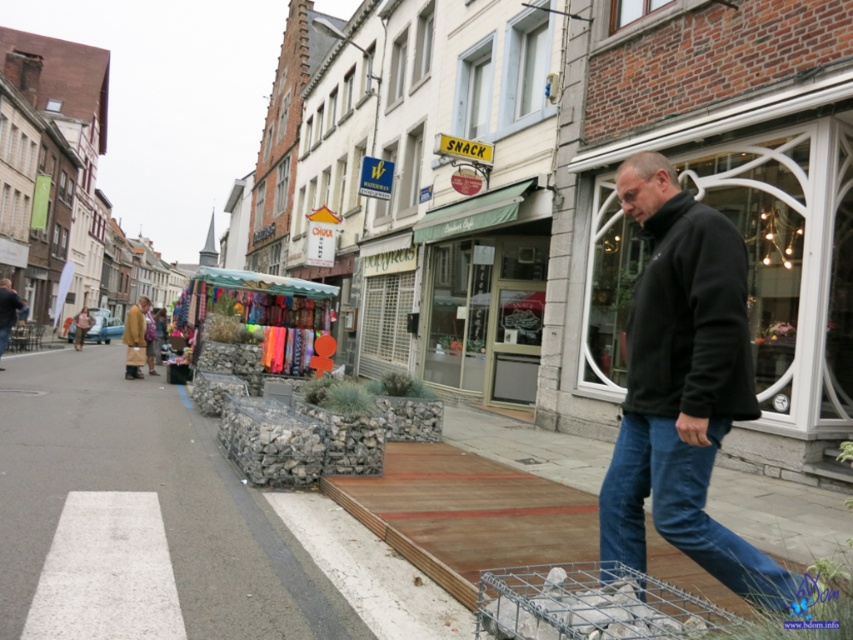
Question: Can you confirm if dark brown leather jacket at lower left is positioned to the right of light brown leather jacket at lower left?

Choices:
 (A) no
 (B) yes

Answer: (A)

Question: Is gray concrete pavement at lower left above brown leather jacket at center?

Choices:
 (A) yes
 (B) no

Answer: (B)

Question: Among these objects, which one is nearest to the camera?

Choices:
 (A) wire mesh cart at lower center
 (B) black fleece jacket at right
 (C) blue denim jeans at lower right
 (D) light brown leather jacket at lower left

Answer: (A)

Question: Among these points, which one is farthest from the camera?

Choices:
 (A) (495, 627)
 (B) (431, 266)

Answer: (B)

Question: Among these points, which one is nearest to the camera?

Choices:
 (A) (675, 522)
 (B) (685, 278)
 (C) (218, 502)
 (D) (532, 180)

Answer: (A)

Question: Is blue denim jeans at lower right closer to the viewer compared to dark brown leather jacket at lower left?

Choices:
 (A) yes
 (B) no

Answer: (A)